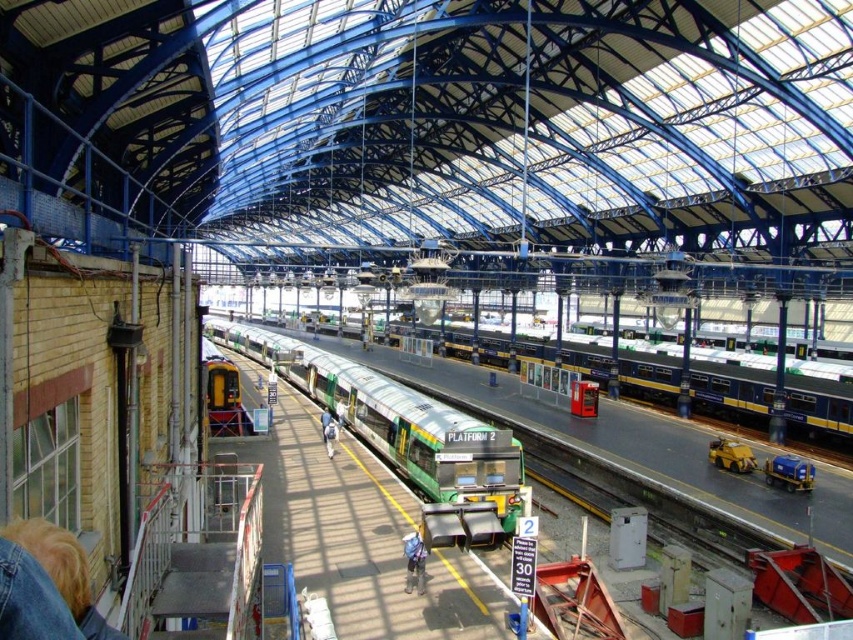
You are standing on a platform in the historic railway station and see both the denim jacket at lower center and the green fabric jacket at center. Which jacket is closer to you?

The denim jacket at lower center is closer to you because it is in front of the green fabric jacket at center.

You are a traveler standing at the central platform of the historic railway station. You see two jackets hanging on a nearby rack. Which jacket is thinner between the blue denim jacket at center and the green fabric jacket at center?

The blue denim jacket at center is thinner than the green fabric jacket at center according to the description.

You are a maintenance worker standing on the upper level of the station and need to reach the denim jacket at lower center for a repair task. The safety regulations state that you can only work within 15 meters of your current position. Can you safely perform the repair without moving closer?

The denim jacket at lower center is 17.39 meters away from the viewer. Since the safety regulations require staying within 15 meters, you cannot safely perform the repair without moving closer.